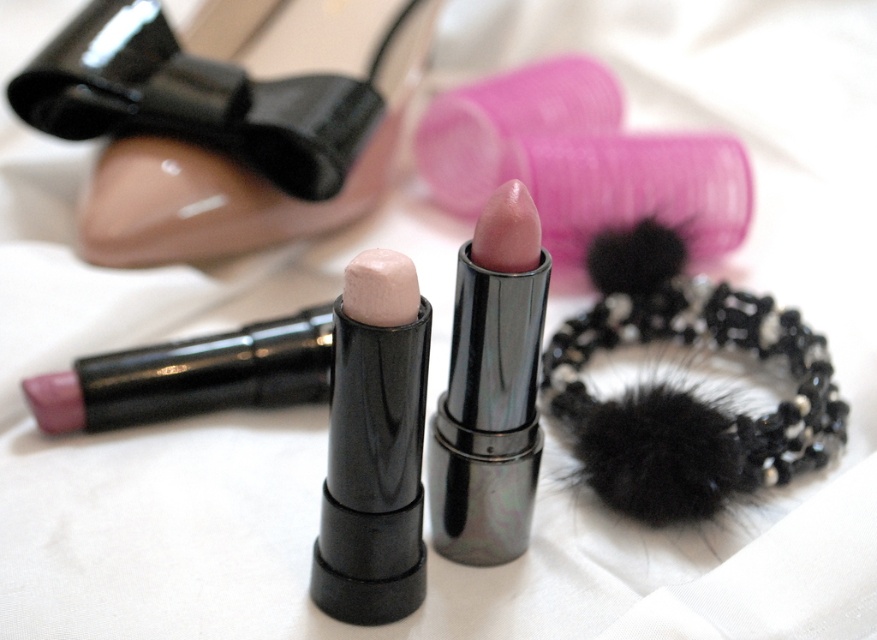
Is point (346, 0) closer to camera compared to point (396, 371)?

No, (346, 0) is further to viewer.

Which of these two, glossy plastic shoe at upper left or pearlized matte highlighter at center, stands taller?

With more height is glossy plastic shoe at upper left.

What are the coordinates of `glossy plastic shoe at upper left` in the screenshot? It's located at coord(239,182).

Find the location of a particular element. The image size is (877, 640). glossy plastic shoe at upper left is located at coordinates [239, 182].

Can you confirm if pearlized matte highlighter at center is positioned below shiny metallic lipstick at center?

Indeed, pearlized matte highlighter at center is positioned under shiny metallic lipstick at center.

The height and width of the screenshot is (640, 877). In order to click on pearlized matte highlighter at center in this screenshot , I will do `click(374, 445)`.

Who is more forward, (237, 204) or (300, 353)?

Point (300, 353)

Does glossy plastic shoe at upper left appear on the right side of matte pink lipstick at center?

Indeed, glossy plastic shoe at upper left is positioned on the right side of matte pink lipstick at center.

Is point (237, 209) positioned in front of point (113, 353)?

No, (237, 209) is further to viewer.

Identify the location of glossy plastic shoe at upper left. The height and width of the screenshot is (640, 877). (239, 182).